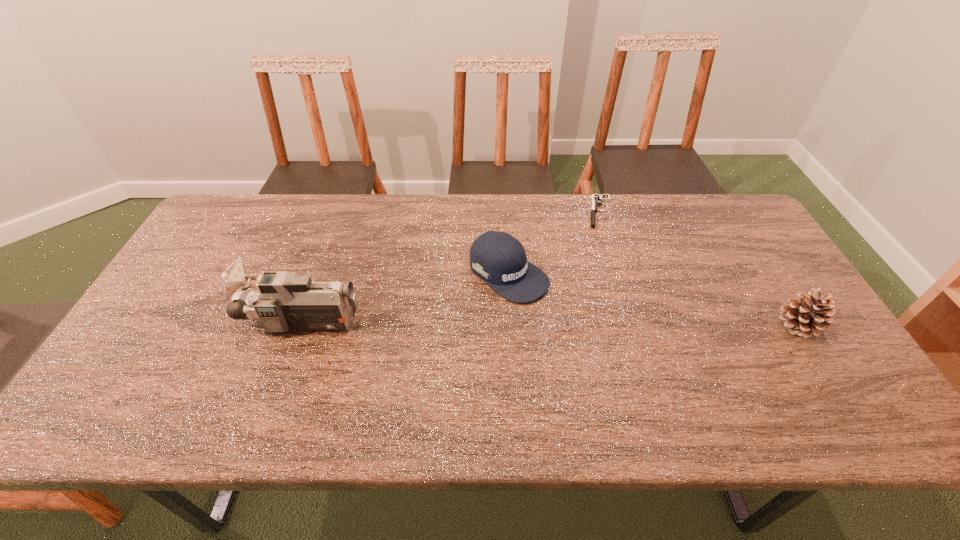
You are a GUI agent. You are given a task and a screenshot of the screen. Output one action in this format:
    pyautogui.click(x=<x>, y=<y>)
    Task: Click on the free region located on the back of the rightmost object
    
    Given the screenshot: What is the action you would take?
    pyautogui.click(x=732, y=221)

Where is `free space located on the front-facing side of the baseball cap`? This screenshot has width=960, height=540. free space located on the front-facing side of the baseball cap is located at coordinates (658, 384).

You are a GUI agent. You are given a task and a screenshot of the screen. Output one action in this format:
    pyautogui.click(x=<x>, y=<y>)
    Task: Click on the free space located 0.370m on the front-facing side of the baseball cap
    The image size is (960, 540).
    Given the screenshot: What is the action you would take?
    pyautogui.click(x=658, y=384)

This screenshot has width=960, height=540. I want to click on vacant space located on the front-facing side of the baseball cap, so click(x=617, y=355).

This screenshot has width=960, height=540. In order to click on free spot located 0.070m on the front-facing side of the second object from right to left in this screenshot , I will do `click(603, 242)`.

At what (x,y) coordinates should I click in order to perform the action: click on free space located on the front-facing side of the second object from right to left. Please return your answer as a coordinate pair (x, y). Looking at the image, I should click on (604, 282).

At what (x,y) coordinates should I click in order to perform the action: click on free region located 0.320m on the front-facing side of the second object from right to left. Please return your answer as a coordinate pair (x, y). Looking at the image, I should click on (605, 303).

This screenshot has width=960, height=540. Find the location of `object situated at the far edge`. object situated at the far edge is located at coordinates (596, 200).

At what (x,y) coordinates should I click in order to perform the action: click on object that is at the right edge. Please return your answer as a coordinate pair (x, y). Image resolution: width=960 pixels, height=540 pixels. Looking at the image, I should click on (807, 316).

In the image, there is a desktop. In order to click on vacant space at the far edge in this screenshot , I will do `click(313, 200)`.